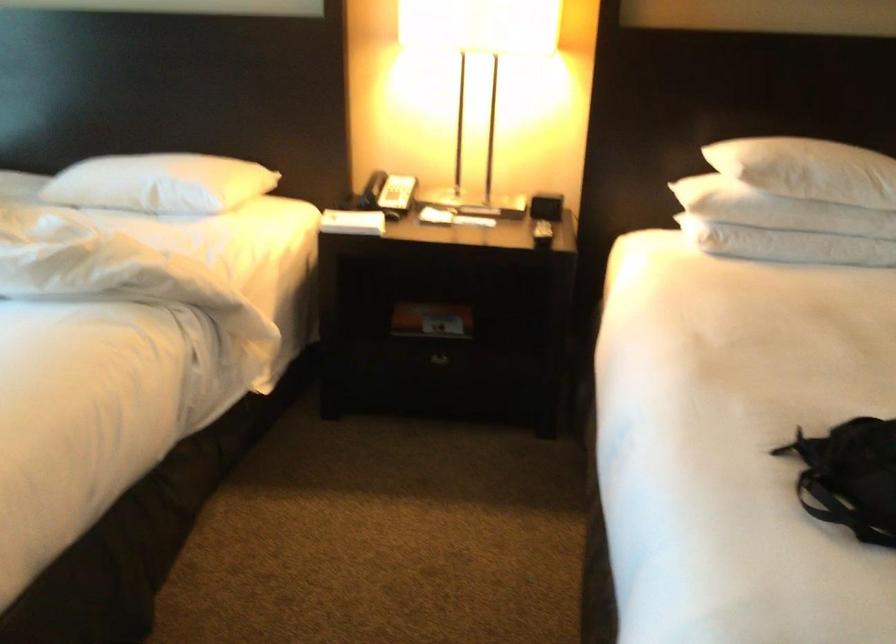
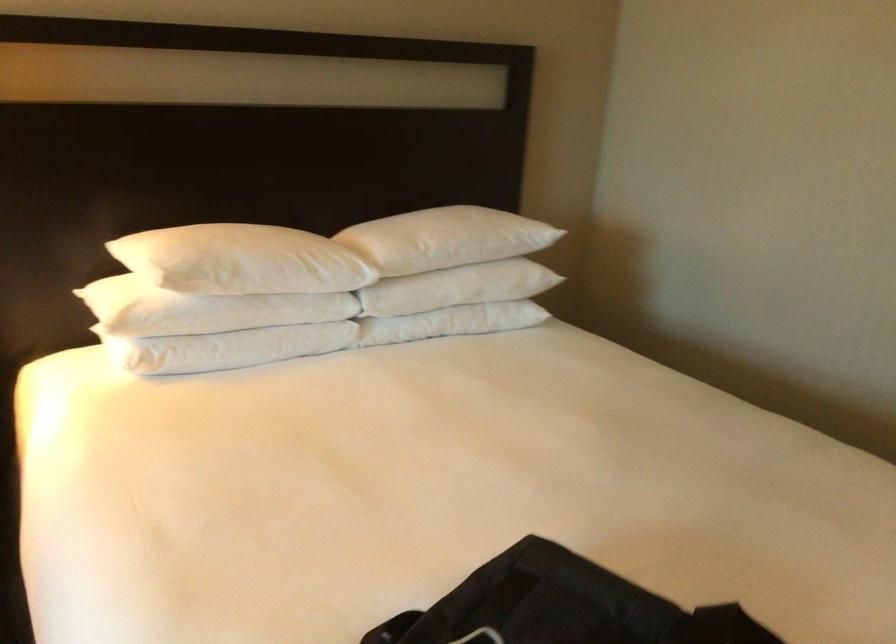
Question: How did the camera likely rotate?

Choices:
 (A) Left
 (B) Right
 (C) Up
 (D) Down

Answer: (B)